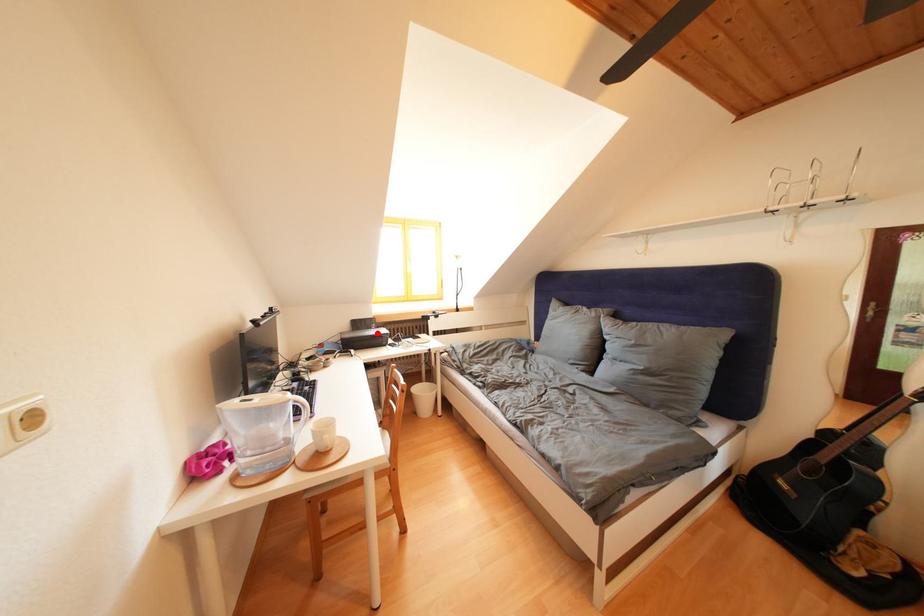
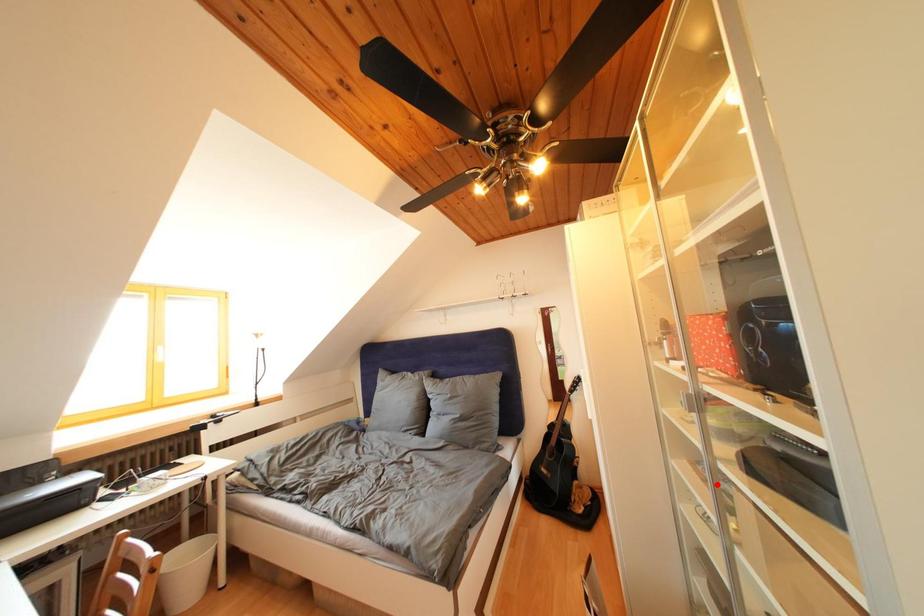
I am providing you with two images of the same scene from different viewpoints. A red point is marked on the first image and another point is marked on the second image. Is the red point in image1 aligned with the point shown in image2?

No